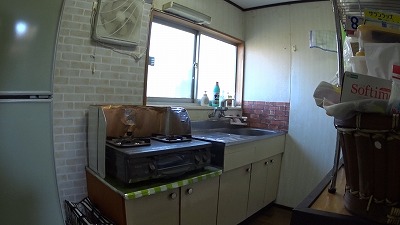
The image size is (400, 225). I want to click on white cord to wall fan, so click(137, 56).